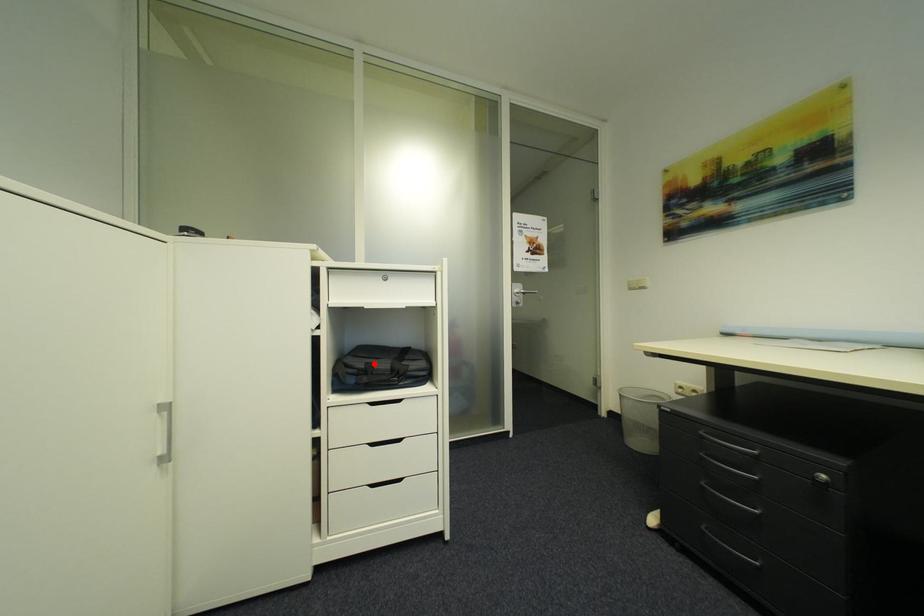
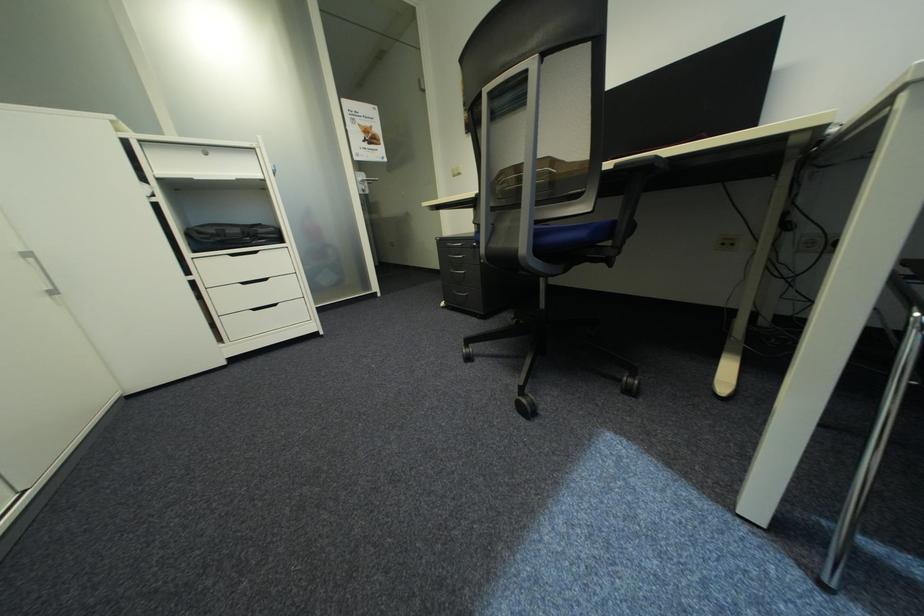
Question: A red point is marked in image1. In image2, is the corresponding 3D point closer to the camera or farther? Reply with the corresponding letter.

Choices:
 (A) The corresponding 3D point is closer.
 (B) The corresponding 3D point is farther.

Answer: (A)